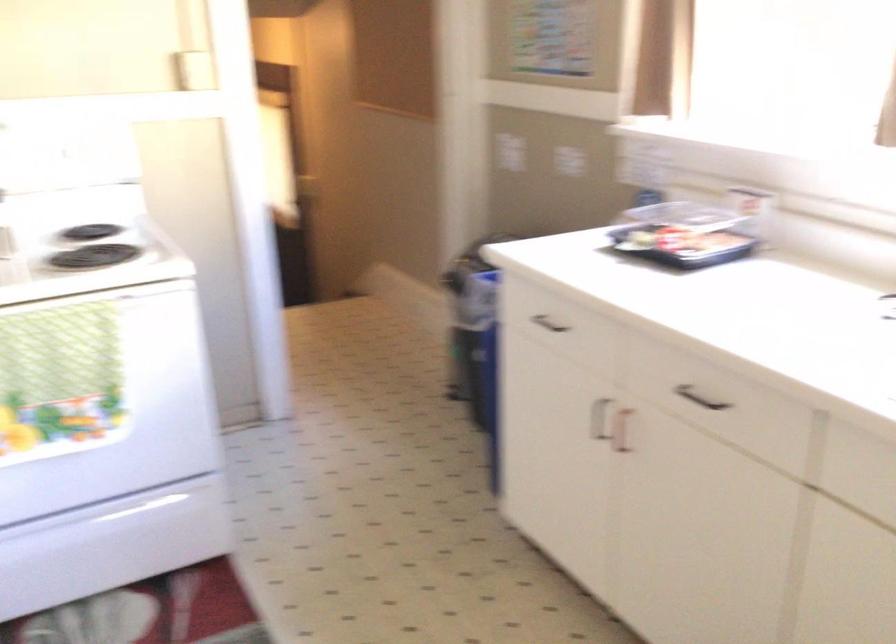
Where is `white light switch`? This screenshot has height=644, width=896. white light switch is located at coordinates (x=510, y=152).